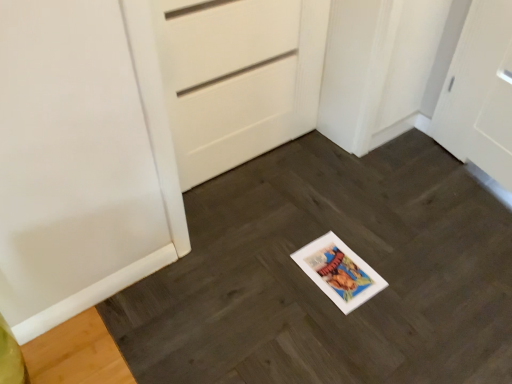
Question: Is white paper at center bigger or smaller than white matte door at center?

Choices:
 (A) big
 (B) small

Answer: (A)

Question: Relative to white matte door at center, is white paper at center in front or behind?

Choices:
 (A) behind
 (B) front

Answer: (B)

Question: Considering the positions of point (493, 291) and point (198, 172), is point (493, 291) closer or farther from the camera than point (198, 172)?

Choices:
 (A) farther
 (B) closer

Answer: (B)

Question: From the image's perspective, is white matte door at center located above or below white paper at center?

Choices:
 (A) above
 (B) below

Answer: (A)

Question: Considering their positions, is white matte door at center located in front of or behind white paper at center?

Choices:
 (A) behind
 (B) front

Answer: (A)

Question: Would you say white matte door at center is inside or outside white paper at center?

Choices:
 (A) inside
 (B) outside

Answer: (B)

Question: Based on their positions, is white matte door at center located to the left or right of white paper at center?

Choices:
 (A) left
 (B) right

Answer: (A)